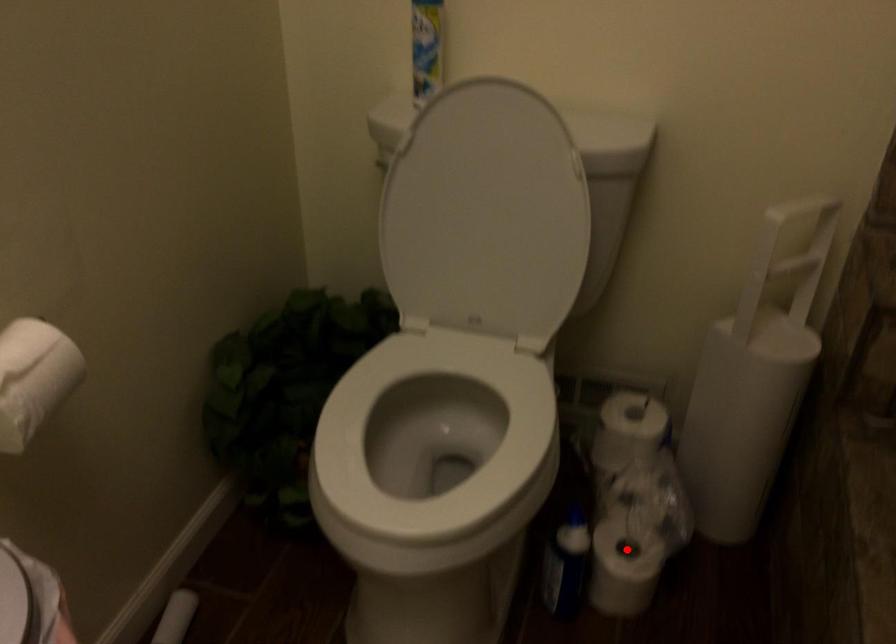
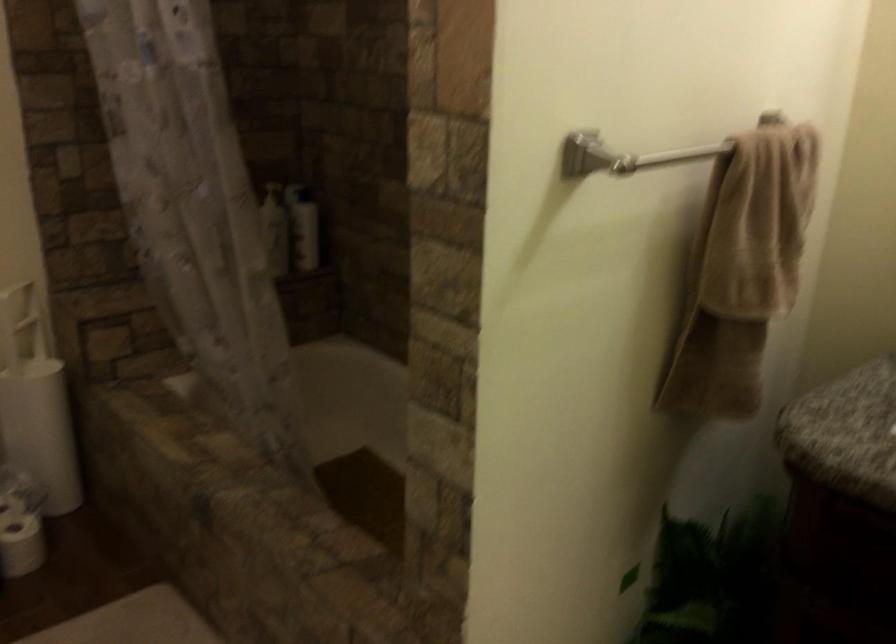
Locate, in the second image, the point that corresponds to the highlighted location in the first image.

(20, 524)